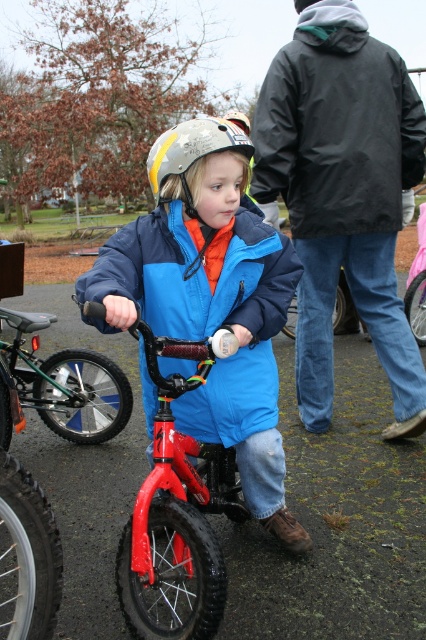
Question: Which object is closer to the camera taking this photo?

Choices:
 (A) shiny red bicycle at center
 (B) red matte bicycle at center
 (C) matte yellow and gray helmet at center
 (D) dark gray/waterproof jacket at upper center

Answer: (A)

Question: Does dark gray/waterproof jacket at upper center lie in front of matte yellow and gray helmet at center?

Choices:
 (A) yes
 (B) no

Answer: (B)

Question: Is dark gray/waterproof jacket at upper center to the left of matte yellow and gray helmet at center from the viewer's perspective?

Choices:
 (A) yes
 (B) no

Answer: (B)

Question: Which point is closer to the camera?

Choices:
 (A) red matte bicycle at center
 (B) metallic silver bicycle at center

Answer: (A)

Question: Among these points, which one is nearest to the camera?

Choices:
 (A) (229, 484)
 (B) (252, 488)
 (C) (414, 278)
 (D) (36, 326)

Answer: (B)

Question: Does shiny red bicycle at center lie behind red matte bicycle at center?

Choices:
 (A) yes
 (B) no

Answer: (B)